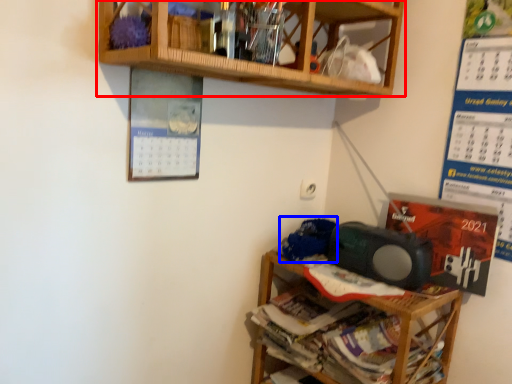
Question: Among these objects, which one is nearest to the camera, shelf (highlighted by a red box) or waste (highlighted by a blue box)?

Choices:
 (A) shelf
 (B) waste

Answer: (A)